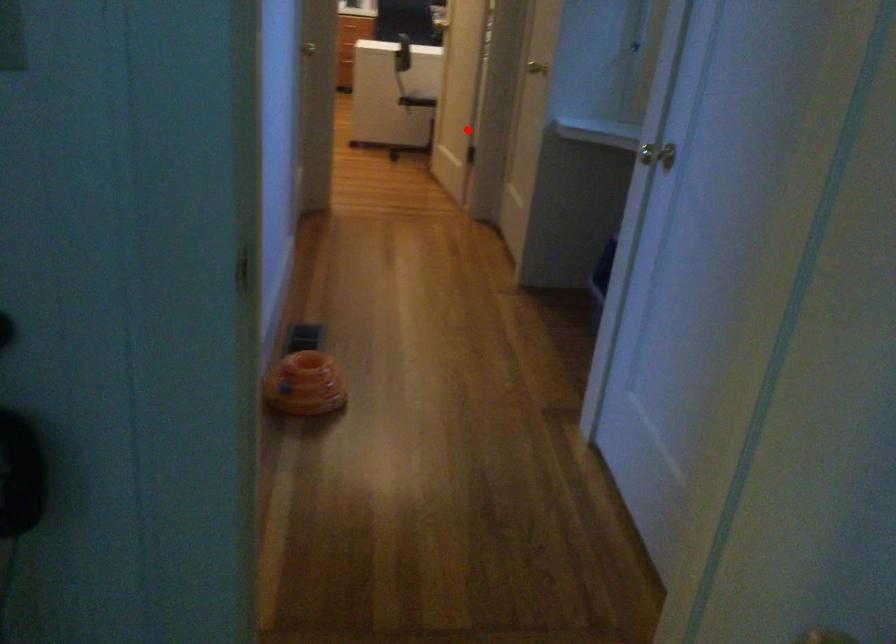
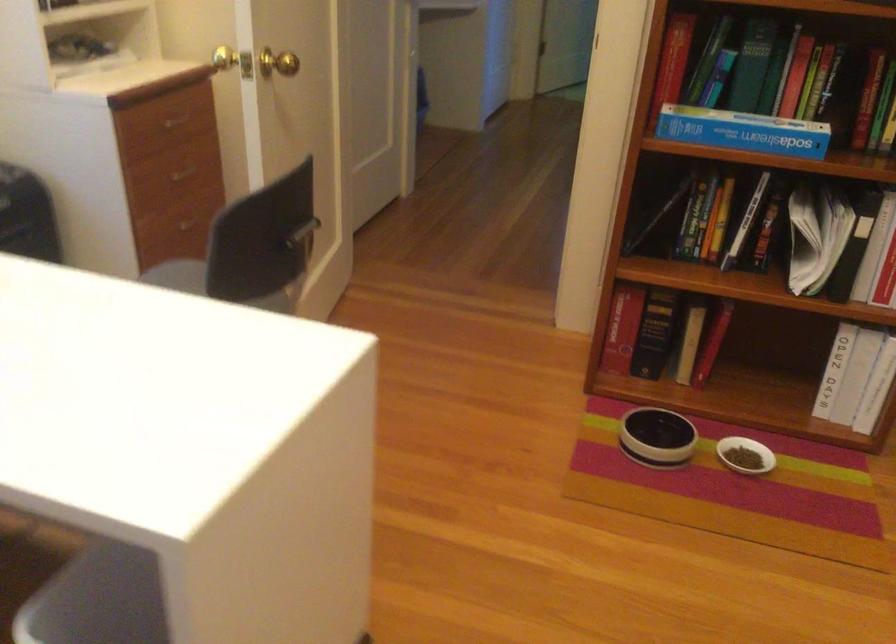
Locate, in the second image, the point that corresponds to the highlighted location in the first image.

(304, 232)